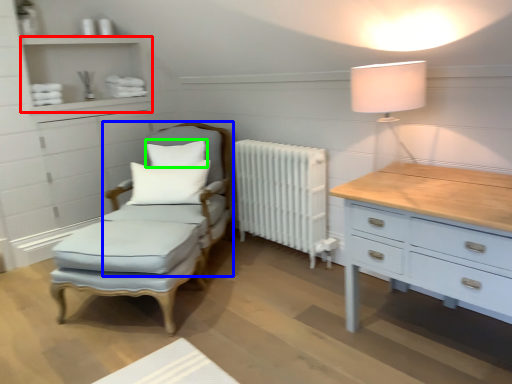
Question: Considering the real-world distances, which object is farthest from shelf (highlighted by a red box)? swivel chair (highlighted by a blue box) or pillow (highlighted by a green box)?

Choices:
 (A) swivel chair
 (B) pillow

Answer: (A)